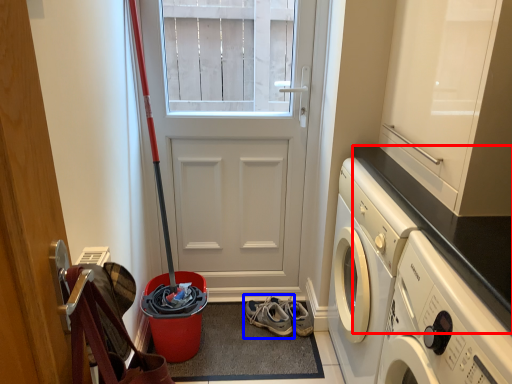
Question: Which object appears farthest to the camera in this image, counter top (highlighted by a red box) or footwear (highlighted by a blue box)?

Choices:
 (A) counter top
 (B) footwear

Answer: (B)